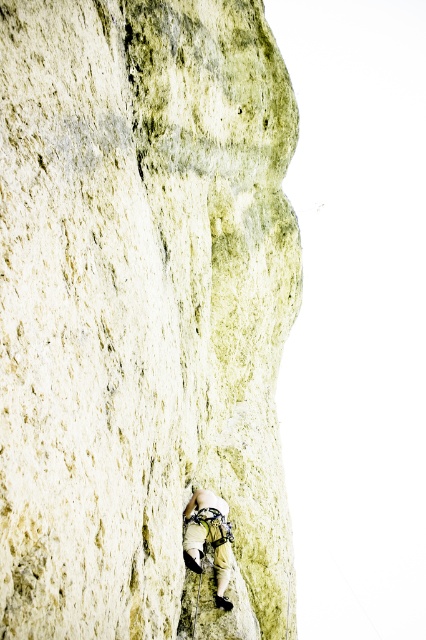
At what (x,y) coordinates should I click in order to perform the action: click on yellowish rock at center. Please return your answer as a coordinate pair (x, y). This screenshot has height=640, width=426. Looking at the image, I should click on (143, 314).

Identify the location of yellowish rock at center. pos(143,314).